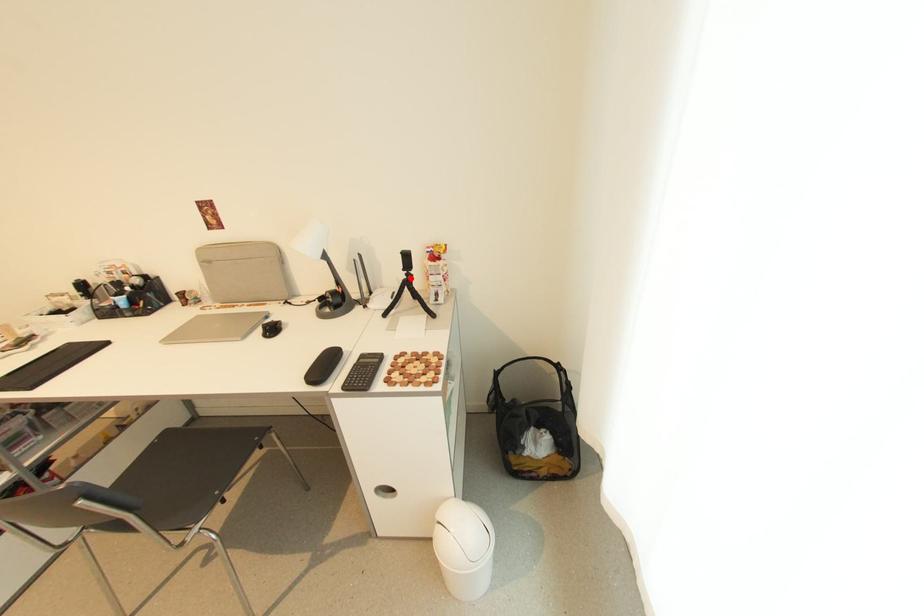
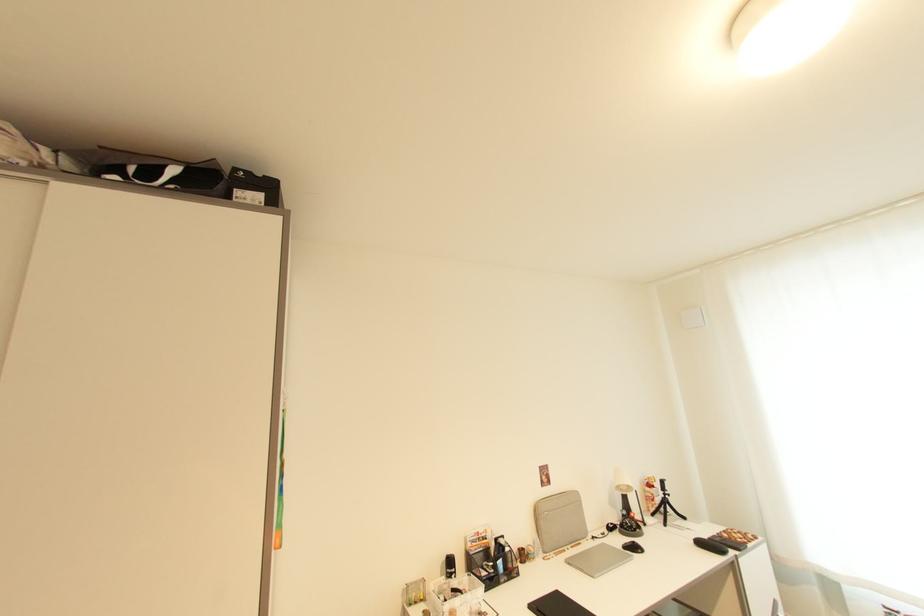
Question: I am providing you with two images of the same scene from different viewpoints. In image1, a red point is highlighted. Considering the same 3D point in image2, which of the following is correct?

Choices:
 (A) It is closer
 (B) It is farther

Answer: (B)